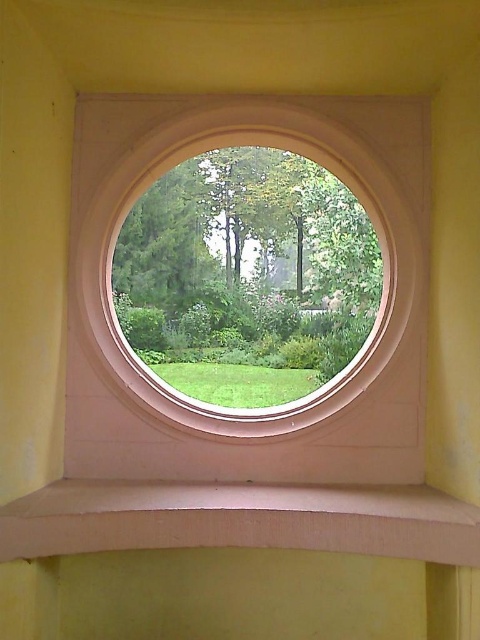
Question: From the image, what is the correct spatial relationship of white smooth window frame at center in relation to smooth beige ledge at lower center?

Choices:
 (A) below
 (B) above

Answer: (B)

Question: Which object appears farthest from the camera in this image?

Choices:
 (A) white smooth window frame at center
 (B) smooth beige ledge at lower center

Answer: (A)

Question: From the image, what is the correct spatial relationship of white smooth window frame at center in relation to smooth beige ledge at lower center?

Choices:
 (A) right
 (B) left

Answer: (A)

Question: Is white smooth window frame at center above smooth beige ledge at lower center?

Choices:
 (A) no
 (B) yes

Answer: (B)